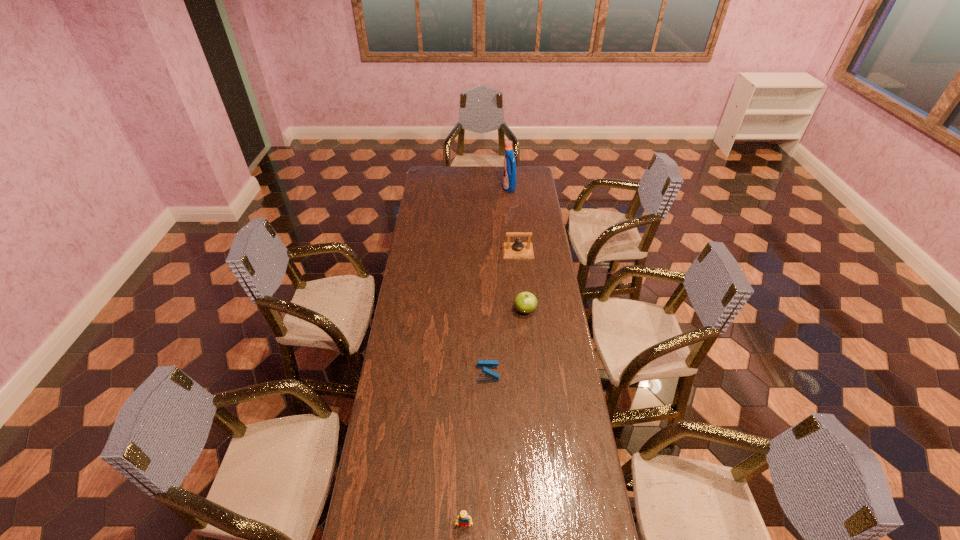
I want to click on free space at the left edge of the desktop, so click(x=421, y=301).

You are a GUI agent. You are given a task and a screenshot of the screen. Output one action in this format:
    pyautogui.click(x=<x>, y=<y>)
    Task: Click on the blank space at the right edge
    Image resolution: width=960 pixels, height=540 pixels.
    Given the screenshot: What is the action you would take?
    click(545, 227)

This screenshot has height=540, width=960. In the image, there is a desktop. Identify the location of free region at the far left corner. (425, 167).

This screenshot has width=960, height=540. I want to click on free space between the tallest object and the leftmost object, so click(x=487, y=356).

What are the coordinates of `free point between the fourth farthest object and the second farthest object` in the screenshot? It's located at (503, 312).

Locate an element on the screen. The width and height of the screenshot is (960, 540). free point between the bell and the stapler is located at coordinates (503, 312).

Locate an element on the screen. This screenshot has height=540, width=960. free space between the farthest object and the bell is located at coordinates (514, 220).

The width and height of the screenshot is (960, 540). Find the location of `vacant point located between the leftmost object and the stapler`. vacant point located between the leftmost object and the stapler is located at coordinates (476, 449).

This screenshot has height=540, width=960. In order to click on vacant space that is in between the stapler and the Lego in this screenshot , I will do `click(476, 449)`.

Where is `free area in between the Lego and the stapler`? free area in between the Lego and the stapler is located at coordinates (476, 449).